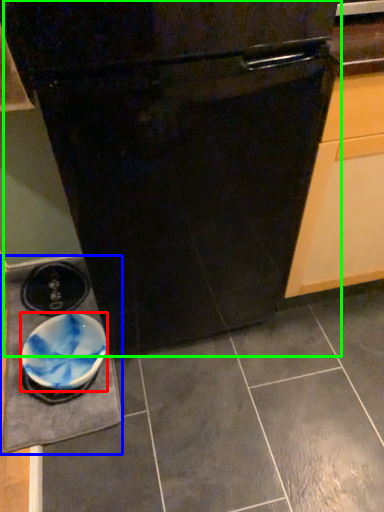
Question: Which object is the closest to the bowl (highlighted by a red box)? Choose among these: slate (highlighted by a blue box) or oven (highlighted by a green box).

Choices:
 (A) slate
 (B) oven

Answer: (A)